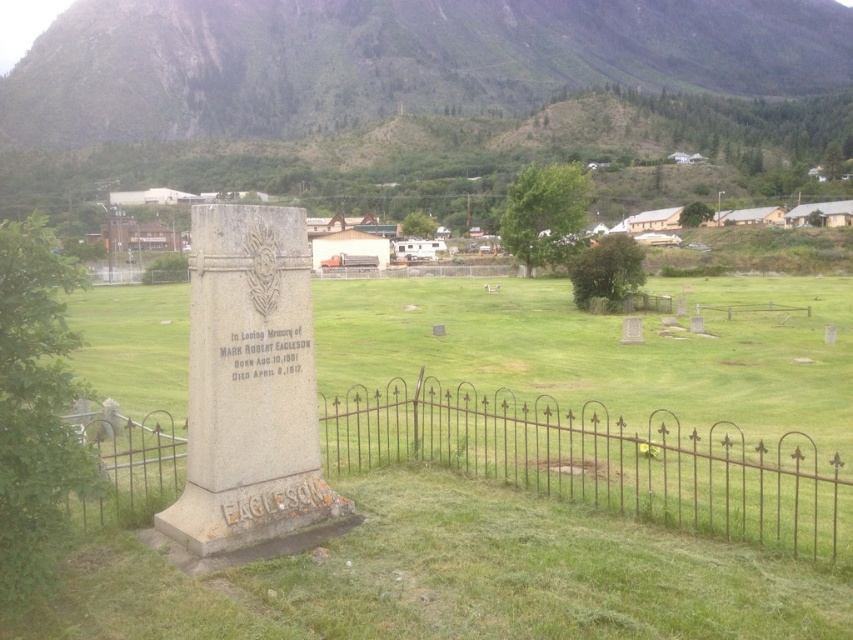
You are standing at the base of the green grassy hill at upper center. Looking towards the cemetery, where would you see the gravestone dedicated to Mark Robert Eagleson?

The gravestone dedicated to Mark Robert Eagleson is located at the foreground of the cemetery, which is in front of the green grassy hill at upper center since the hill is positioned at point [392,60] in the image.

You are standing at the entrance of the cemetery and want to walk towards the green grassy at center and the green grassy hill at upper center. Which one would you encounter first?

You would encounter the green grassy at center first because it is located below the green grassy hill at upper center, meaning it is closer to your starting position at the entrance.

You are standing in the cemetery looking at the graves. There are two points marked in the image, point 1 at coordinates point (485,52) and point 2 at coordinates point (751,449). Which point is closer to you?

Point 1 at coordinates point (485,52) is closer to you because it is further to the viewer than point 2 at coordinates point (751,449).